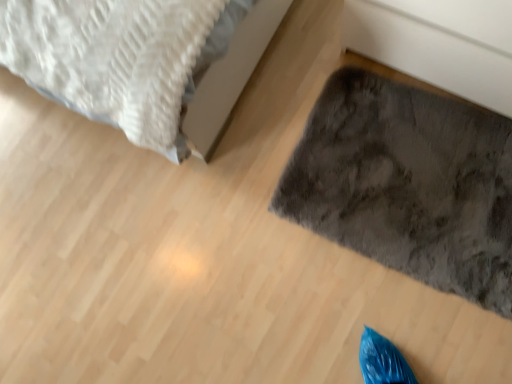
Find the location of a particular element. blank space situated above gray fluffy rug at lower right (from a real-world perspective) is located at coordinates point(412,183).